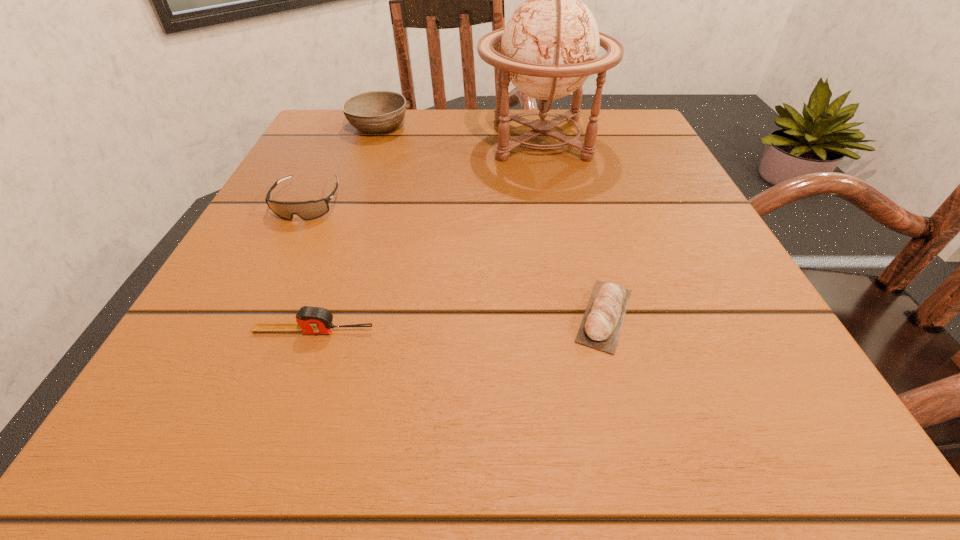
Locate an element on the screen. This screenshot has width=960, height=540. vacant area between the bowl and the tallest object is located at coordinates (459, 133).

Find the location of a particular element. The width and height of the screenshot is (960, 540). vacant region between the tape measure and the shortest object is located at coordinates (459, 323).

Identify the location of unoccupied position between the goggles and the shortest object. (456, 259).

In order to click on vacant space in between the shortest object and the globe in this screenshot , I will do `click(572, 227)`.

You are a GUI agent. You are given a task and a screenshot of the screen. Output one action in this format:
    pyautogui.click(x=<x>, y=<y>)
    Task: Click on the empty location between the tallest object and the pita bread
    This screenshot has height=540, width=960.
    Given the screenshot: What is the action you would take?
    pyautogui.click(x=572, y=227)

Identify which object is located as the nearest to the second tallest object. Please provide its 2D coordinates. Your answer should be formatted as a tuple, i.e. [(x, y)], where the tuple contains the x and y coordinates of a point satisfying the conditions above.

[(549, 47)]

At what (x,y) coordinates should I click in order to perform the action: click on the fourth closest object relative to the tallest object. Please return your answer as a coordinate pair (x, y). The height and width of the screenshot is (540, 960). Looking at the image, I should click on (311, 320).

Where is `vacant region that satisfies the following two spatial constraints: 1. on the back side of the tape measure; 2. on the right side of the shortest object`? vacant region that satisfies the following two spatial constraints: 1. on the back side of the tape measure; 2. on the right side of the shortest object is located at coordinates (320, 315).

Identify the location of blank area in the image that satisfies the following two spatial constraints: 1. on the front side of the second tallest object; 2. on the right side of the shortest object. (308, 315).

I want to click on free space that satisfies the following two spatial constraints: 1. on the front-facing side of the tallest object; 2. on the lenses of the goggles, so click(x=554, y=203).